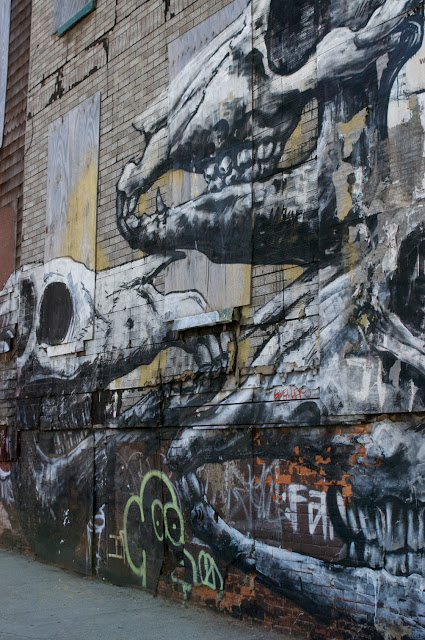
You are a GUI agent. You are given a task and a screenshot of the screen. Output one action in this format:
    pyautogui.click(x=<x>, y=<y>)
    Task: Click on the window frame
    
    Given the screenshot: What is the action you would take?
    pyautogui.click(x=75, y=19)